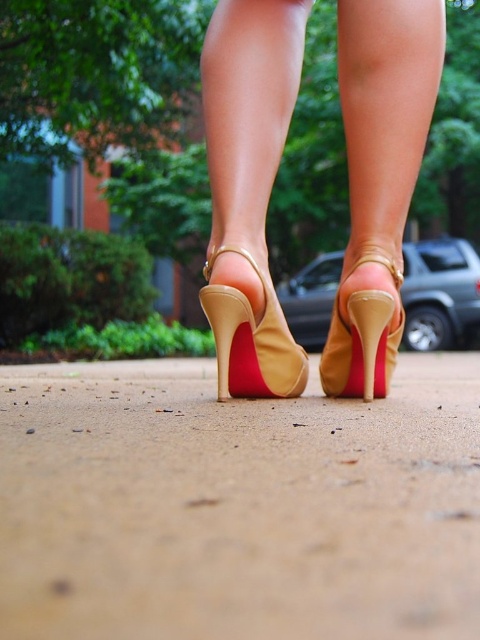
Question: Does sandy beige pavement at center have a greater width compared to metallic silver car at center?

Choices:
 (A) no
 (B) yes

Answer: (B)

Question: Among these points, which one is nearest to the camera?

Choices:
 (A) [443, 445]
 (B) [250, 321]
 (C) [357, 340]
 (D) [292, 321]

Answer: (A)

Question: Can you confirm if sandy beige pavement at center is positioned to the left of metallic silver car at center?

Choices:
 (A) yes
 (B) no

Answer: (A)

Question: In this image, where is satin beige high heels at center located relative to metallic silver car at center?

Choices:
 (A) left
 (B) right

Answer: (A)

Question: Among these objects, which one is farthest from the camera?

Choices:
 (A) metallic silver car at center
 (B) suede tan sandal at center
 (C) satin beige high heels at center

Answer: (A)

Question: Among these objects, which one is farthest from the camera?

Choices:
 (A) satin beige high heels at center
 (B) sandy beige pavement at center
 (C) tan suede high-heeled sandal at center
 (D) suede tan sandal at center

Answer: (D)